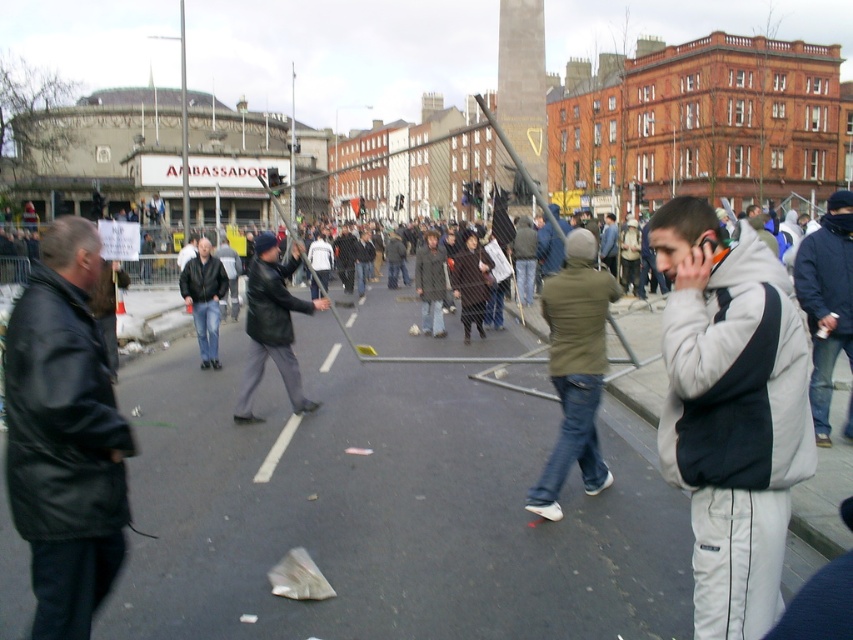
You are a photographer trying to capture a clear photo of both the gray fleece jacket at center and the matte black jacket at center. Since you want them both in focus, you need to know their positions relative to each other. Which jacket is on the right side when looking at the scene?

The gray fleece jacket at center is positioned on the right side of the matte black jacket at center.

You are a photographer standing at the center of the street. You want to take a picture of the black leather jacket at left. Where should you point your camera to capture it?

You should point your camera towards the left side of the frame at point coordinates approximately 0.681 on the x axis and 0.076 on the y axis to capture the black leather jacket at left.

You are a photographer trying to capture both the gray fleece jacket at center and the matte black jacket at center in a single shot. Based on their heights, which jacket will appear shorter in the photo?

The gray fleece jacket at center will appear shorter in the photo because it is not as tall as the matte black jacket at center.